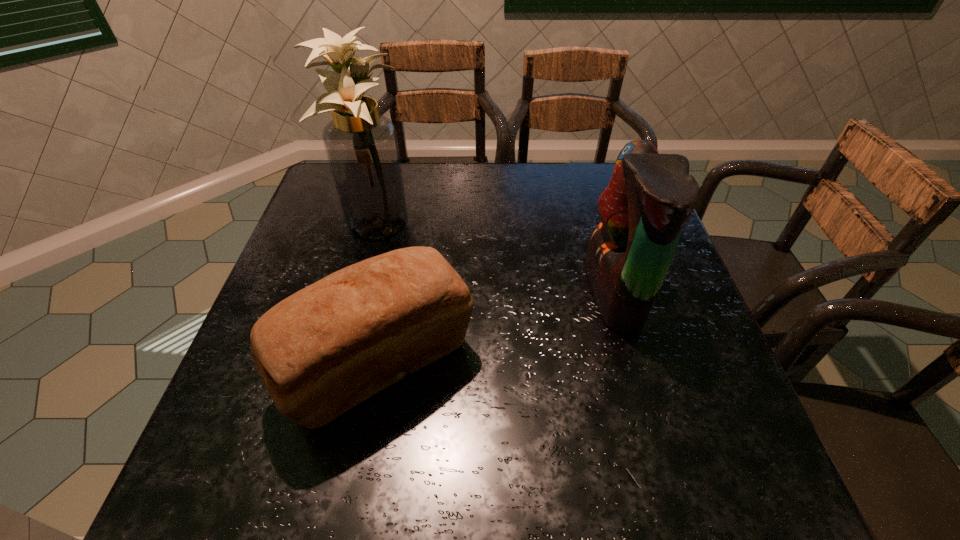
Where is `the closest object to the bread`? the closest object to the bread is located at coordinates (361, 145).